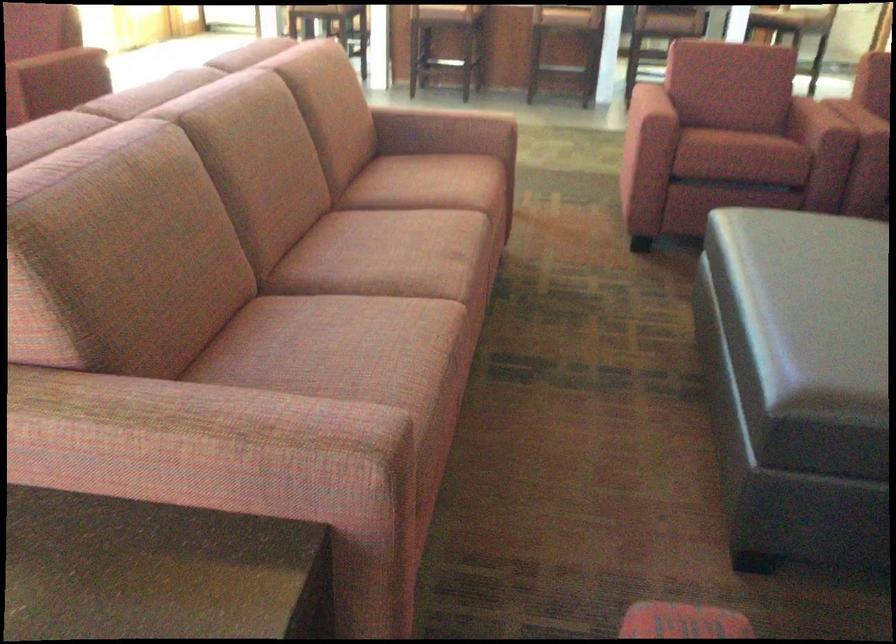
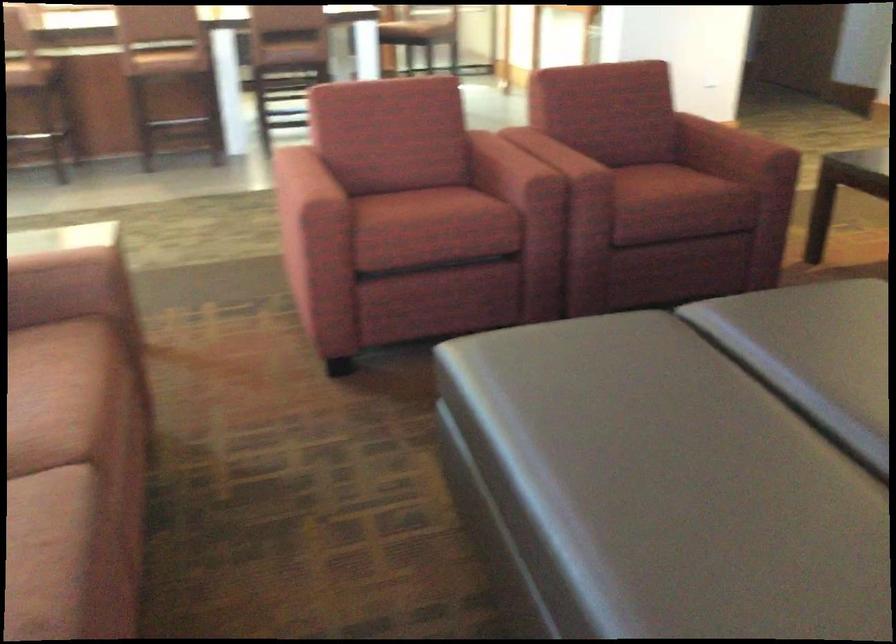
Question: Which direction would the cameraman need to move to produce the second image? Reply with the corresponding letter.

Choices:
 (A) Left
 (B) Right
 (C) Forward
 (D) Backward

Answer: (C)